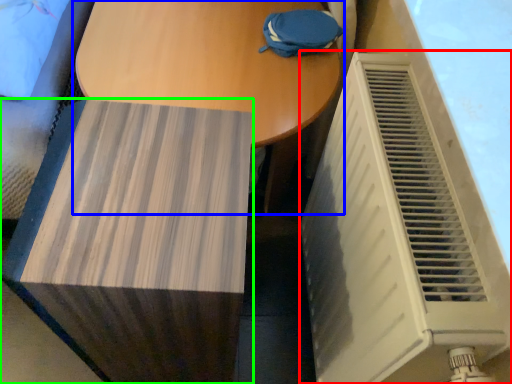
Question: Which is farther away from air conditioning (highlighted by a red box)? table (highlighted by a blue box) or furniture (highlighted by a green box)?

Choices:
 (A) table
 (B) furniture

Answer: (A)